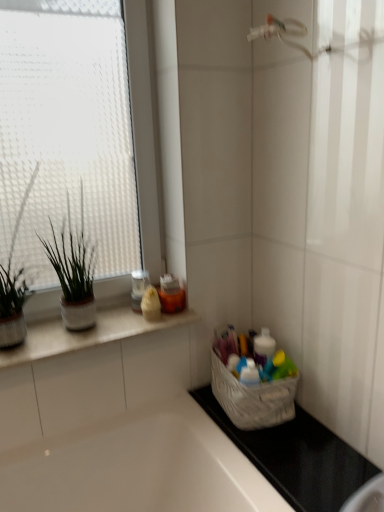
Find the location of a particular element. The image size is (384, 512). green matte plant at left, which ranks as the 1th houseplant in right-to-left order is located at coordinates (74, 275).

Locate an element on the screen. white ceramic countertop at upper left is located at coordinates (87, 334).

What do you see at coordinates (138, 467) in the screenshot?
I see `white glossy bathtub at lower left` at bounding box center [138, 467].

The width and height of the screenshot is (384, 512). What are the coordinates of `white fabric basket at lower right` in the screenshot? It's located at (253, 398).

This screenshot has width=384, height=512. What are the coordinates of `transparent glass window at upper left` in the screenshot? It's located at (67, 131).

Can you tell me how much green matte plant at left, which ranks as the 1th houseplant in right-to-left order, and white ceramic countertop at upper left differ in facing direction?

There is a 0.47-degree angle between the facing directions of green matte plant at left, which ranks as the 1th houseplant in right-to-left order, and white ceramic countertop at upper left.

Which is correct: green matte plant at left, which ranks as the 1th houseplant in right-to-left order, is inside white ceramic countertop at upper left, or outside of it?

green matte plant at left, which ranks as the 1th houseplant in right-to-left order, lies outside white ceramic countertop at upper left.

From a real-world perspective, relative to white ceramic countertop at upper left, is green matte plant at left, which ranks as the 1th houseplant in right-to-left order, vertically above or below?

green matte plant at left, which ranks as the 1th houseplant in right-to-left order, is above white ceramic countertop at upper left.

From the image's perspective, is green matte plant at left, which ranks as the 1th houseplant in right-to-left order, above or below white ceramic countertop at upper left?

green matte plant at left, which ranks as the 1th houseplant in right-to-left order, is above white ceramic countertop at upper left.

How different are the orientations of green matte plant at left, which is the second houseplant from right to left, and white glossy bathtub at lower left in degrees?

The angular difference between green matte plant at left, which is the second houseplant from right to left, and white glossy bathtub at lower left is 0.254 degrees.

Is green matte plant at left, which is the second houseplant from right to left, wider or thinner than white glossy bathtub at lower left?

Clearly, green matte plant at left, which is the second houseplant from right to left, has less width compared to white glossy bathtub at lower left.

Could you tell me if green matte plant at left, which is counted as the 1th houseplant, starting from the left, is turned towards white glossy bathtub at lower left?

No.

Consider the image. Can you tell me how much black rubber mat at lower right and green matte plant at left, which is counted as the second houseplant, starting from the left, differ in facing direction?

The angle between the facing direction of black rubber mat at lower right and the facing direction of green matte plant at left, which is counted as the second houseplant, starting from the left, is 0.171 degrees.

How distant is black rubber mat at lower right from green matte plant at left, which is counted as the second houseplant, starting from the left?

A distance of 29.24 inches exists between black rubber mat at lower right and green matte plant at left, which is counted as the second houseplant, starting from the left.

Can you confirm if black rubber mat at lower right is wider than green matte plant at left, which is counted as the second houseplant, starting from the left?

Indeed, black rubber mat at lower right has a greater width compared to green matte plant at left, which is counted as the second houseplant, starting from the left.

Is black rubber mat at lower right placed right next to green matte plant at left, which ranks as the 1th houseplant in right-to-left order?

No, black rubber mat at lower right is not beside green matte plant at left, which ranks as the 1th houseplant in right-to-left order.

Which point is more forward, (150, 326) or (75, 165)?

The point (75, 165) is closer to the camera.

Does white ceramic countertop at upper left turn towards transparent glass window at upper left?

No, white ceramic countertop at upper left is not aimed at transparent glass window at upper left.

Based on the photo, are white ceramic countertop at upper left and transparent glass window at upper left beside each other?

No, white ceramic countertop at upper left is not touching transparent glass window at upper left.

How much distance is there between white ceramic countertop at upper left and transparent glass window at upper left?

white ceramic countertop at upper left and transparent glass window at upper left are 20.80 inches apart from each other.

Between white glossy bathtub at lower left and transparent glass window at upper left, which one has larger size?

white glossy bathtub at lower left.

From a real-world perspective, relative to transparent glass window at upper left, is white glossy bathtub at lower left vertically above or below?

Clearly, from a real-world perspective, white glossy bathtub at lower left is below transparent glass window at upper left.

Could you tell me if white glossy bathtub at lower left is turned towards transparent glass window at upper left?

No, white glossy bathtub at lower left is not facing towards transparent glass window at upper left.

Is white glossy bathtub at lower left wider or thinner than transparent glass window at upper left?

white glossy bathtub at lower left is wider than transparent glass window at upper left.

In the scene shown: Considering the sizes of green matte plant at left, which ranks as the 1th houseplant in right-to-left order, and black rubber mat at lower right in the image, is green matte plant at left, which ranks as the 1th houseplant in right-to-left order, taller or shorter than black rubber mat at lower right?

green matte plant at left, which ranks as the 1th houseplant in right-to-left order, is taller than black rubber mat at lower right.

Between point (52, 230) and point (204, 391), which one is positioned behind?

The point (204, 391) is farther.

Is green matte plant at left, which is counted as the second houseplant, starting from the left, smaller than black rubber mat at lower right?

Actually, green matte plant at left, which is counted as the second houseplant, starting from the left, might be larger than black rubber mat at lower right.

Is white glossy bathtub at lower left closer to camera compared to green matte plant at left, which ranks as the 1th houseplant in right-to-left order?

Yes, it is.

Considering the sizes of white glossy bathtub at lower left and green matte plant at left, which ranks as the 1th houseplant in right-to-left order, in the image, is white glossy bathtub at lower left taller or shorter than green matte plant at left, which ranks as the 1th houseplant in right-to-left order,?

Clearly, white glossy bathtub at lower left is taller compared to green matte plant at left, which ranks as the 1th houseplant in right-to-left order.

Can you confirm if white glossy bathtub at lower left is positioned to the left of green matte plant at left, which is counted as the second houseplant, starting from the left?

In fact, white glossy bathtub at lower left is to the right of green matte plant at left, which is counted as the second houseplant, starting from the left.

This screenshot has width=384, height=512. I want to click on houseplant that is the 1st object to the left of the white ceramic countertop at upper left, starting at the anchor, so click(x=74, y=275).

From a real-world perspective, which houseplant is the 2nd one above the white glossy bathtub at lower left? Please provide its 2D coordinates.

[(14, 287)]

When comparing their distances from white glossy bathtub at lower left, does green matte plant at left, which is the second houseplant from right to left, or white fabric basket at lower right seem closer?

white fabric basket at lower right is positioned closer to the anchor white glossy bathtub at lower left.

Estimate the real-world distances between objects in this image. Which object is further from white glossy bathtub at lower left, green matte plant at left, which is the second houseplant from right to left, or transparent glass window at upper left?

Based on the image, transparent glass window at upper left appears to be further to white glossy bathtub at lower left.

Which object lies nearer to the anchor point green matte plant at left, which ranks as the 1th houseplant in right-to-left order, transparent glass window at upper left or white glossy bathtub at lower left?

transparent glass window at upper left is positioned closer to the anchor green matte plant at left, which ranks as the 1th houseplant in right-to-left order.

When comparing their distances from green matte plant at left, which is counted as the second houseplant, starting from the left, does white ceramic countertop at upper left or transparent glass window at upper left seem further?

transparent glass window at upper left is positioned further to the anchor green matte plant at left, which is counted as the second houseplant, starting from the left.

From the image, which object appears to be farther from transparent glass window at upper left, white ceramic countertop at upper left or black rubber mat at lower right?

black rubber mat at lower right lies further to transparent glass window at upper left than the other object.

Considering their positions, is black rubber mat at lower right positioned further to white fabric basket at lower right than green matte plant at left, which ranks as the 1th houseplant in right-to-left order?

Based on the image, green matte plant at left, which ranks as the 1th houseplant in right-to-left order, appears to be further to white fabric basket at lower right.

Considering their positions, is white fabric basket at lower right positioned closer to transparent glass window at upper left than white glossy bathtub at lower left?

white glossy bathtub at lower left is closer to transparent glass window at upper left.

Based on their spatial positions, is transparent glass window at upper left or white glossy bathtub at lower left further from white ceramic countertop at upper left?

transparent glass window at upper left lies further to white ceramic countertop at upper left than the other object.

Locate an element on the screen. The height and width of the screenshot is (512, 384). countertop between transparent glass window at upper left and white glossy bathtub at lower left in the up-down direction is located at coordinates (87, 334).

Locate an element on the screen. This screenshot has height=512, width=384. basket between green matte plant at left, which is the second houseplant from right to left, and white glossy bathtub at lower left in the up-down direction is located at coordinates (253, 398).

You are a GUI agent. You are given a task and a screenshot of the screen. Output one action in this format:
    pyautogui.click(x=<x>, y=<y>)
    Task: Click on the window located between green matte plant at left, which is the second houseplant from right to left, and white fabric basket at lower right in the left-right direction
    Image resolution: width=384 pixels, height=512 pixels.
    Given the screenshot: What is the action you would take?
    pyautogui.click(x=67, y=131)

The height and width of the screenshot is (512, 384). Identify the location of counter top between green matte plant at left, which ranks as the 1th houseplant in right-to-left order, and white glossy bathtub at lower left, in the vertical direction. (297, 457).